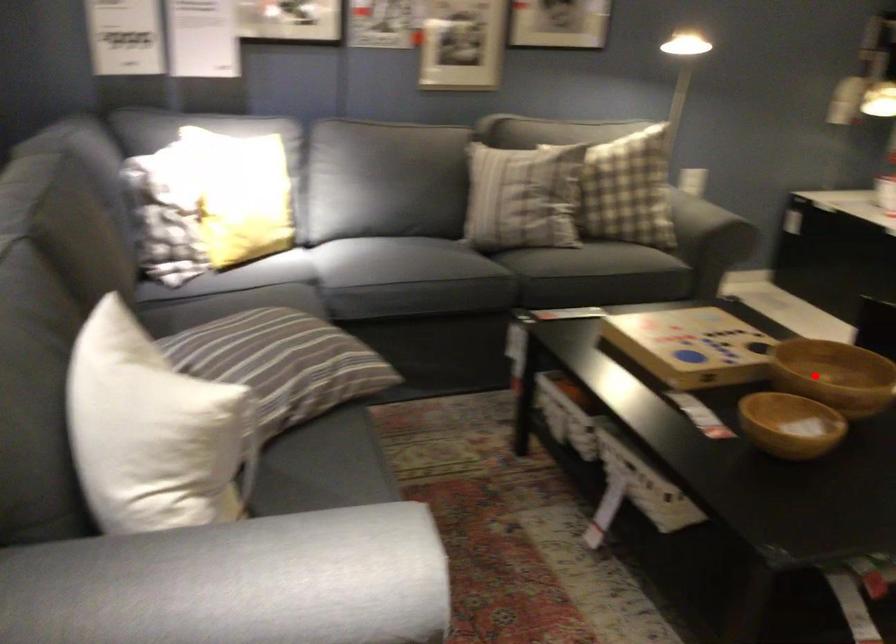
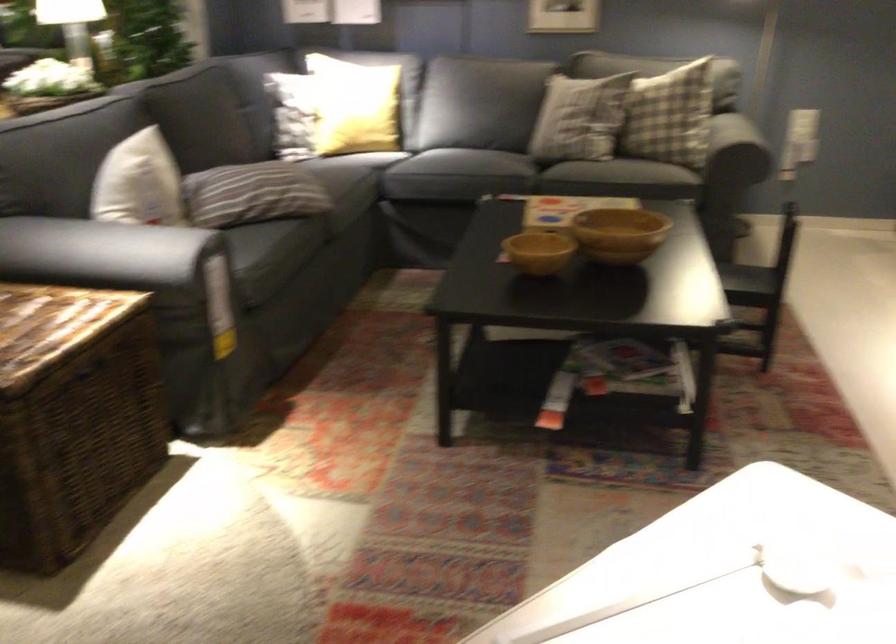
Question: I am providing you with two images of the same scene from different viewpoints. In image1, a red point is highlighted. Considering the same 3D point in image2, which of the following is correct?

Choices:
 (A) It is closer
 (B) It is farther

Answer: (B)